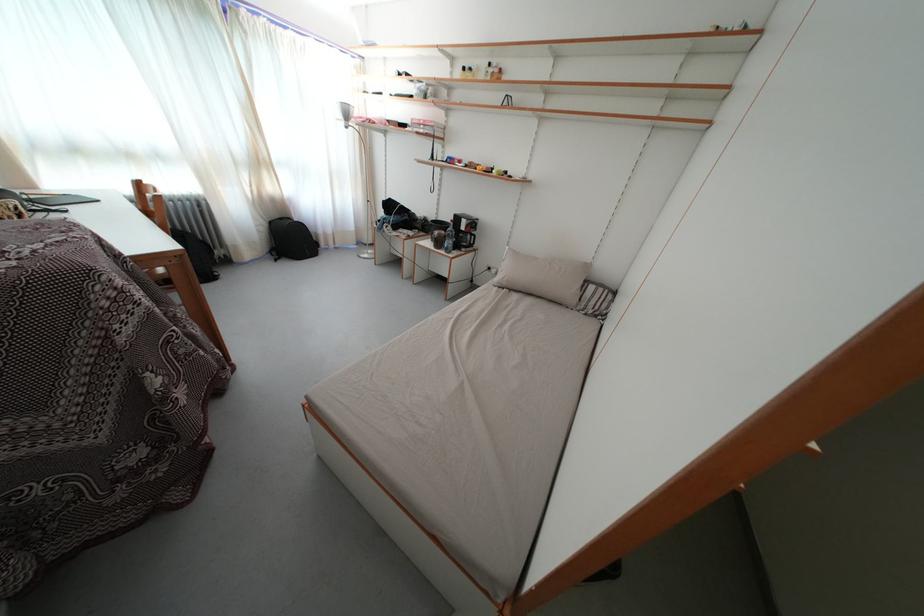
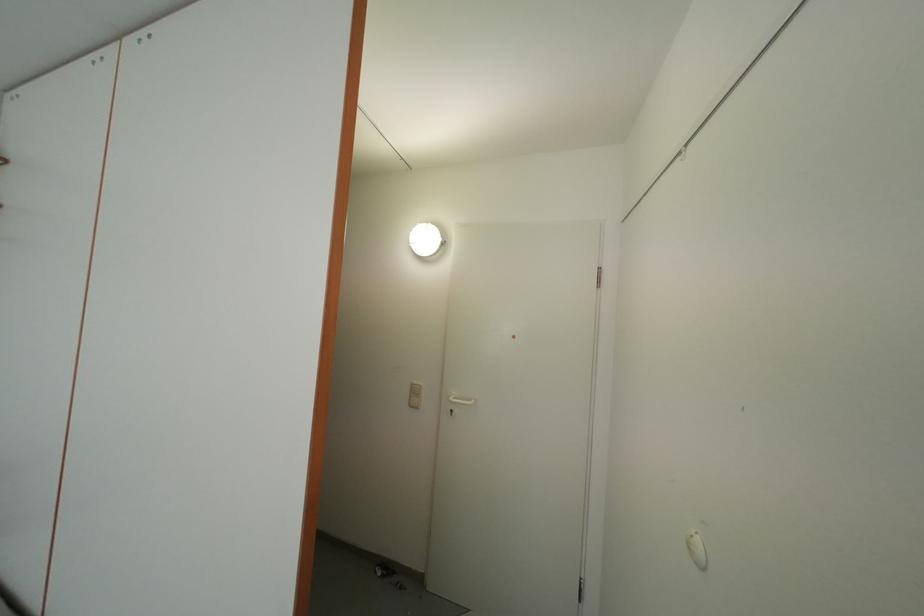
Question: The first image is from the beginning of the video and the second image is from the end. How did the camera likely rotate when shooting the video?

Choices:
 (A) Left
 (B) Right
 (C) Up
 (D) Down

Answer: (B)